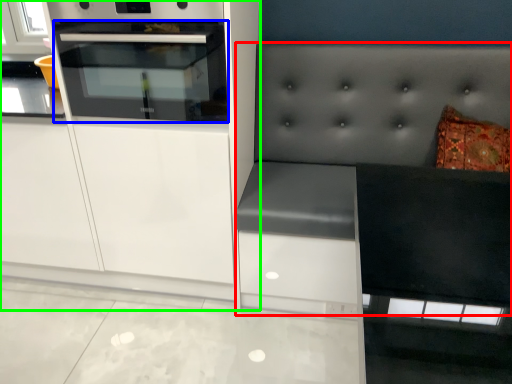
Question: Which is farther away from couch (highlighted by a red box)? oven (highlighted by a blue box) or cabinetry (highlighted by a green box)?

Choices:
 (A) oven
 (B) cabinetry

Answer: (A)